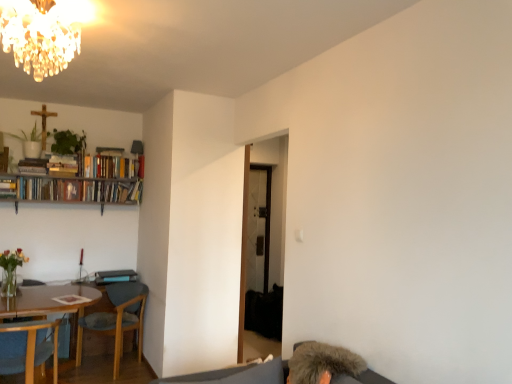
Image resolution: width=512 pixels, height=384 pixels. Describe the element at coordinates (7, 187) in the screenshot. I see `hardcover book at left, marked as the 2th book in a right-to-left arrangement` at that location.

Image resolution: width=512 pixels, height=384 pixels. Describe the element at coordinates (68, 142) in the screenshot. I see `green leafy plant at upper left, the 1th plant positioned from the right` at that location.

Describe the element at coordinates (322, 363) in the screenshot. The image size is (512, 384). I see `fuzzy gray hair at lower right` at that location.

Describe the element at coordinates (11, 270) in the screenshot. I see `green matte vase at lower left` at that location.

Where is `green matte plant at upper left, the 1th plant in the left-to-right sequence`? Image resolution: width=512 pixels, height=384 pixels. green matte plant at upper left, the 1th plant in the left-to-right sequence is located at coordinates (30, 142).

Find the location of `hardcover book at left, arranged as the first book when viewed from the left`. hardcover book at left, arranged as the first book when viewed from the left is located at coordinates (7, 187).

Does crystal glass chandelier at upper left have a lesser height compared to green matte vase at lower left?

Yes.

Between point (64, 52) and point (20, 261), which one is positioned behind?

The point (20, 261) is behind.

From a real-world perspective, which is physically above, crystal glass chandelier at upper left or green matte vase at lower left?

crystal glass chandelier at upper left.

Can you tell me how much crystal glass chandelier at upper left and green matte vase at lower left differ in facing direction?

89.1 degrees.

Which of these two, green matte vase at lower left or wooden chair at lower left, the second chair when ordered from front to back, is smaller?

Smaller between the two is green matte vase at lower left.

Considering the sizes of green matte vase at lower left and wooden chair at lower left, the second chair when ordered from front to back, in the image, is green matte vase at lower left taller or shorter than wooden chair at lower left, the second chair when ordered from front to back,?

Considering their sizes, green matte vase at lower left has less height than wooden chair at lower left, the second chair when ordered from front to back.

Is green matte vase at lower left turned away from wooden chair at lower left, the 1th chair when ordered from back to front?

No, green matte vase at lower left's orientation is not away from wooden chair at lower left, the 1th chair when ordered from back to front.

Does green matte vase at lower left appear on the left side of wooden chair at lower left, the 1th chair when ordered from back to front?

Indeed, green matte vase at lower left is positioned on the left side of wooden chair at lower left, the 1th chair when ordered from back to front.

Is hardcover book at left, arranged as the first book when viewed from the left, not near hardcover books at upper left, the 2th book in the left-to-right sequence?

hardcover book at left, arranged as the first book when viewed from the left, is actually quite close to hardcover books at upper left, the 2th book in the left-to-right sequence.

Where is `book that appears behind the hardcover book at left, marked as the 2th book in a right-to-left arrangement`? The width and height of the screenshot is (512, 384). book that appears behind the hardcover book at left, marked as the 2th book in a right-to-left arrangement is located at coordinates (75, 190).

Does point (11, 181) come farther from viewer compared to point (104, 197)?

No.

Between wooden chair at lower left, the 1th chair viewed from the front, and crystal glass chandelier at upper left, which one has smaller width?

crystal glass chandelier at upper left.

This screenshot has width=512, height=384. In order to click on lamp above the wooden chair at lower left, the 1th chair viewed from the front (from the image's perspective) in this screenshot , I will do `click(38, 36)`.

From the image's perspective, is wooden chair at lower left, placed as the second chair when sorted from back to front, located beneath crystal glass chandelier at upper left?

Yes, from the image's perspective, wooden chair at lower left, placed as the second chair when sorted from back to front, is below crystal glass chandelier at upper left.

From a real-world perspective, is wooden chair at lower left, placed as the second chair when sorted from back to front, positioned above or below crystal glass chandelier at upper left?

Clearly, from a real-world perspective, wooden chair at lower left, placed as the second chair when sorted from back to front, is below crystal glass chandelier at upper left.

Between wooden chair at lower left, the 1th chair when ordered from back to front, and hardcover books at upper left, placed as the first book when sorted from right to left, which one has less height?

hardcover books at upper left, placed as the first book when sorted from right to left, is shorter.

From the image's perspective, is wooden chair at lower left, the 1th chair when ordered from back to front, located beneath hardcover books at upper left, placed as the first book when sorted from right to left?

Indeed, from the image's perspective, wooden chair at lower left, the 1th chair when ordered from back to front, is shown beneath hardcover books at upper left, placed as the first book when sorted from right to left.

Based on the photo, would you say wooden chair at lower left, the second chair when ordered from front to back, is a long distance from hardcover books at upper left, placed as the first book when sorted from right to left?

Indeed, wooden chair at lower left, the second chair when ordered from front to back, is not near hardcover books at upper left, placed as the first book when sorted from right to left.

What's the angular difference between wooden chair at lower left, the 1th chair when ordered from back to front, and hardcover books at upper left, the 2th book in the left-to-right sequence,'s facing directions?

They differ by 55.4 degrees in their facing directions.

Would you say green matte vase at lower left is to the left or to the right of crystal glass chandelier at upper left in the picture?

green matte vase at lower left is positioned on crystal glass chandelier at upper left's left side.

From a real-world perspective, does green matte vase at lower left sit lower than crystal glass chandelier at upper left?

Yes, from a real-world perspective, green matte vase at lower left is below crystal glass chandelier at upper left.

From the image's perspective, is green matte vase at lower left on top of crystal glass chandelier at upper left?

No, from the image's perspective, green matte vase at lower left is not on top of crystal glass chandelier at upper left.

Does green matte vase at lower left have a smaller size compared to crystal glass chandelier at upper left?

Yes.

Which is more to the left, wooden chair at lower left, the second chair when ordered from front to back, or fuzzy gray hair at lower right?

Positioned to the left is wooden chair at lower left, the second chair when ordered from front to back.

Who is smaller, wooden chair at lower left, the second chair when ordered from front to back, or fuzzy gray hair at lower right?

fuzzy gray hair at lower right is smaller.

From a real-world perspective, who is located higher, wooden chair at lower left, the 1th chair when ordered from back to front, or fuzzy gray hair at lower right?

From a 3D spatial view, fuzzy gray hair at lower right is above.

This screenshot has height=384, width=512. Identify the location of houseplant below the crystal glass chandelier at upper left (from the image's perspective). (11, 270).

I want to click on chair behind the green matte vase at lower left, so click(114, 320).

Considering their positions, is fuzzy gray hair at lower right positioned further to green matte plant at upper left, the 1th plant in the left-to-right sequence, than wooden chair at lower left, the 1th chair viewed from the front?

fuzzy gray hair at lower right is further to green matte plant at upper left, the 1th plant in the left-to-right sequence.

Looking at the image, which one is located further to green matte plant at upper left, arranged as the second plant when viewed from the right, green leafy plant at upper left, which ranks as the 2th plant in left-to-right order, or wooden chair at lower left, the 1th chair viewed from the front?

Based on the image, wooden chair at lower left, the 1th chair viewed from the front, appears to be further to green matte plant at upper left, arranged as the second plant when viewed from the right.

Based on their spatial positions, is fuzzy gray hair at lower right or green matte vase at lower left further from crystal glass chandelier at upper left?

Based on the image, fuzzy gray hair at lower right appears to be further to crystal glass chandelier at upper left.

Estimate the real-world distances between objects in this image. Which object is closer to fuzzy gray hair at lower right, green matte vase at lower left or wooden chair at lower left, the 1th chair when ordered from back to front?

wooden chair at lower left, the 1th chair when ordered from back to front, is positioned closer to the anchor fuzzy gray hair at lower right.

Which object lies nearer to the anchor point wooden chair at lower left, placed as the second chair when sorted from back to front, crystal glass chandelier at upper left or green matte vase at lower left?

green matte vase at lower left lies closer to wooden chair at lower left, placed as the second chair when sorted from back to front, than the other object.

Which object lies further to the anchor point green leafy plant at upper left, the 1th plant positioned from the right, hardcover book at left, marked as the 2th book in a right-to-left arrangement, or fuzzy gray hair at lower right?

fuzzy gray hair at lower right is further to green leafy plant at upper left, the 1th plant positioned from the right.

Which object lies nearer to the anchor point wooden chair at lower left, the 1th chair viewed from the front, wooden chair at lower left, the 1th chair when ordered from back to front, or green matte vase at lower left?

green matte vase at lower left is positioned closer to the anchor wooden chair at lower left, the 1th chair viewed from the front.

Based on their spatial positions, is hardcover book at left, marked as the 2th book in a right-to-left arrangement, or crystal glass chandelier at upper left further from green leafy plant at upper left, the 1th plant positioned from the right?

Based on the image, crystal glass chandelier at upper left appears to be further to green leafy plant at upper left, the 1th plant positioned from the right.

Find the location of a particular element. book that lies between hardcover book at left, marked as the 2th book in a right-to-left arrangement, and wooden chair at lower left, the second chair when ordered from front to back, from top to bottom is located at coordinates (75, 190).

Identify the location of lamp between green matte vase at lower left and fuzzy gray hair at lower right. (38, 36).

Where is `plant between green matte vase at lower left and fuzzy gray hair at lower right in the horizontal direction`? plant between green matte vase at lower left and fuzzy gray hair at lower right in the horizontal direction is located at coordinates (68, 142).

This screenshot has width=512, height=384. Find the location of `chair between crystal glass chandelier at upper left and wooden chair at lower left, the second chair when ordered from front to back, in the vertical direction`. chair between crystal glass chandelier at upper left and wooden chair at lower left, the second chair when ordered from front to back, in the vertical direction is located at coordinates (28, 347).